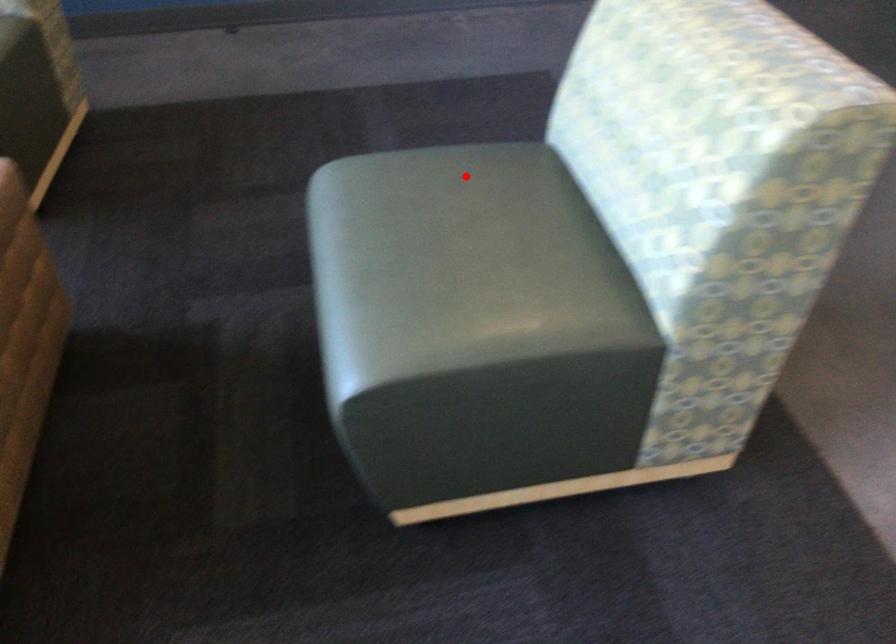
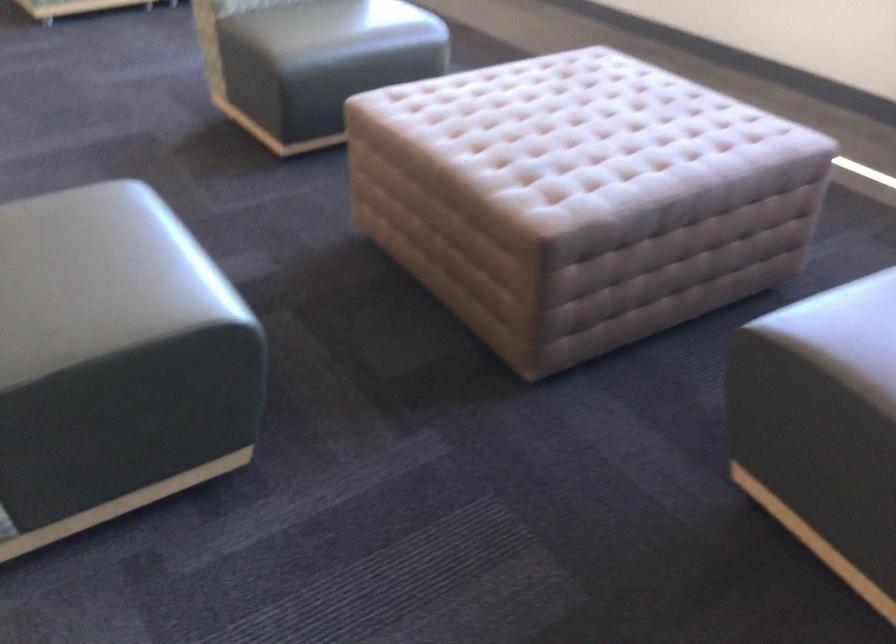
In the second image, find the point that corresponds to the highlighted location in the first image.

(99, 278)